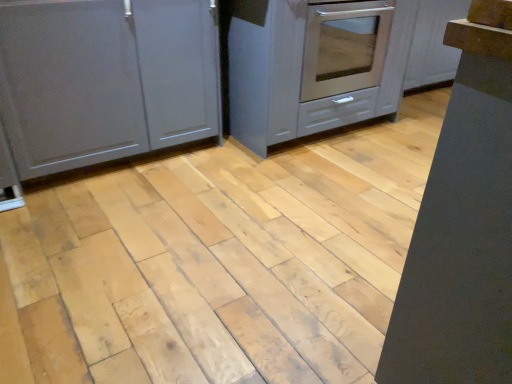
Question: From a real-world perspective, is satin gray cabinet at center, the 1th cabinetry in the right-to-left sequence, physically located above or below matte gray cabinet at left, which ranks as the 2th cabinetry in right-to-left order?

Choices:
 (A) below
 (B) above

Answer: (B)

Question: Is satin gray cabinet at center, which is the 2th cabinetry from left to right, taller or shorter than matte gray cabinet at left, the 1th cabinetry in the left-to-right sequence?

Choices:
 (A) tall
 (B) short

Answer: (B)

Question: Considering their positions, is satin gray cabinet at center, which is the 2th cabinetry from left to right, located in front of or behind matte gray cabinet at left, which ranks as the 2th cabinetry in right-to-left order?

Choices:
 (A) behind
 (B) front

Answer: (A)

Question: From the image's perspective, relative to satin gray cabinet at center, which is the 2th cabinetry from left to right, is matte gray cabinet at left, which ranks as the 2th cabinetry in right-to-left order, above or below?

Choices:
 (A) below
 (B) above

Answer: (A)

Question: Considering the positions of point (103, 97) and point (307, 34), is point (103, 97) closer or farther from the camera than point (307, 34)?

Choices:
 (A) farther
 (B) closer

Answer: (B)

Question: Do you think matte gray cabinet at left, the 1th cabinetry in the left-to-right sequence, is within satin gray cabinet at center, which is the 2th cabinetry from left to right, or outside of it?

Choices:
 (A) outside
 (B) inside

Answer: (A)

Question: Considering their positions, is matte gray cabinet at left, which ranks as the 2th cabinetry in right-to-left order, located in front of or behind satin gray cabinet at center, the 1th cabinetry in the right-to-left sequence?

Choices:
 (A) behind
 (B) front

Answer: (B)